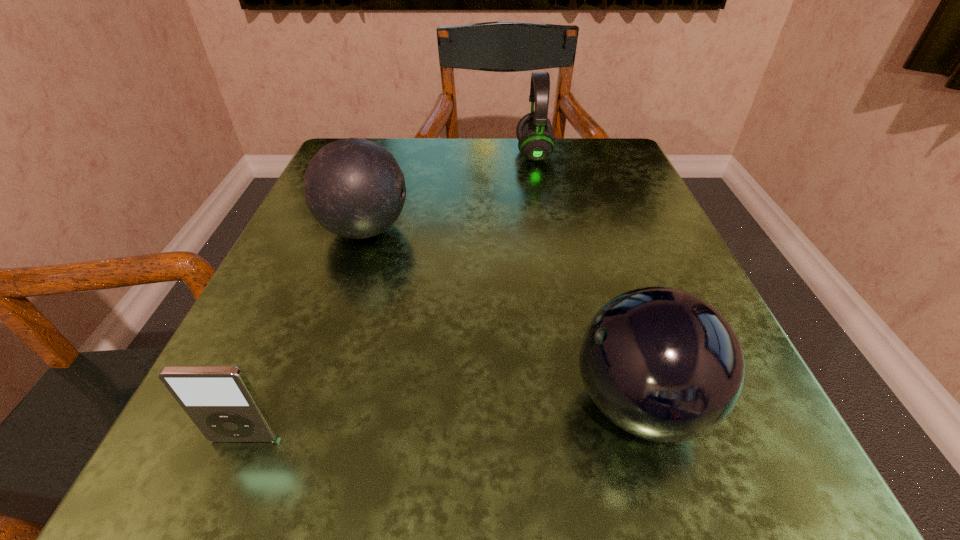
Identify the location of headset. The width and height of the screenshot is (960, 540). point(536,142).

Identify the location of the second farthest object. The image size is (960, 540). (354, 188).

What are the coordinates of `the farther bowling ball` in the screenshot? It's located at (354, 188).

Locate an element on the screen. The height and width of the screenshot is (540, 960). the right bowling ball is located at coordinates (662, 364).

The image size is (960, 540). I want to click on the shortest object, so click(220, 400).

Image resolution: width=960 pixels, height=540 pixels. I want to click on free space located 0.170m on the ear cups of the headset, so click(440, 153).

This screenshot has width=960, height=540. Find the location of `free region located on the ear cups of the headset`. free region located on the ear cups of the headset is located at coordinates (386, 153).

You are a GUI agent. You are given a task and a screenshot of the screen. Output one action in this format:
    pyautogui.click(x=<x>, y=<y>)
    Task: Click on the vacant space situated on the ear cups of the headset
    This screenshot has height=540, width=960.
    Given the screenshot: What is the action you would take?
    pyautogui.click(x=399, y=153)

Where is `free point located 0.310m on the grip area of the left bowling ball`? The height and width of the screenshot is (540, 960). free point located 0.310m on the grip area of the left bowling ball is located at coordinates (588, 230).

The height and width of the screenshot is (540, 960). I want to click on free space located 0.350m on the side of the nearer bowling ball with the finger holes, so click(x=272, y=404).